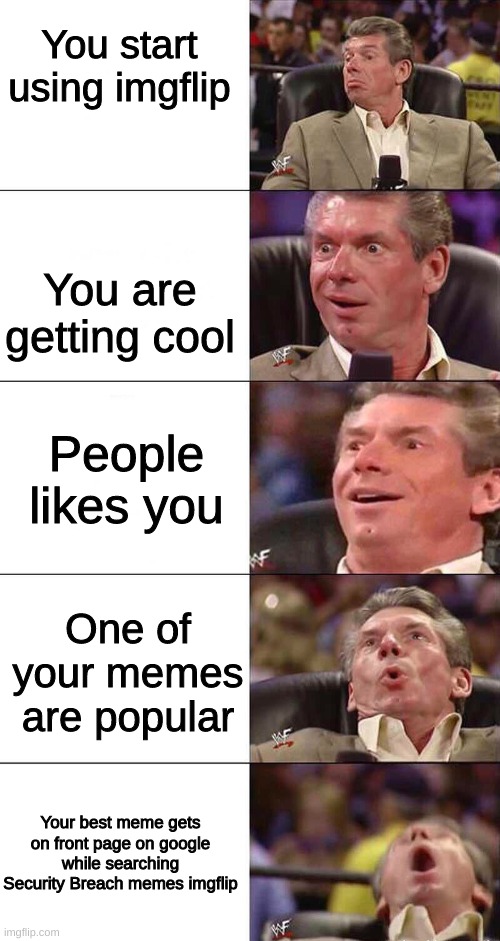
At what (x,y) coordinates should I click in order to perform the action: click on padded chairs. Please return your answer as a coordinate pair (x, y). The height and width of the screenshot is (941, 500). Looking at the image, I should click on (309, 924), (278, 690), (473, 517), (372, 760), (464, 307), (485, 82), (321, 84).